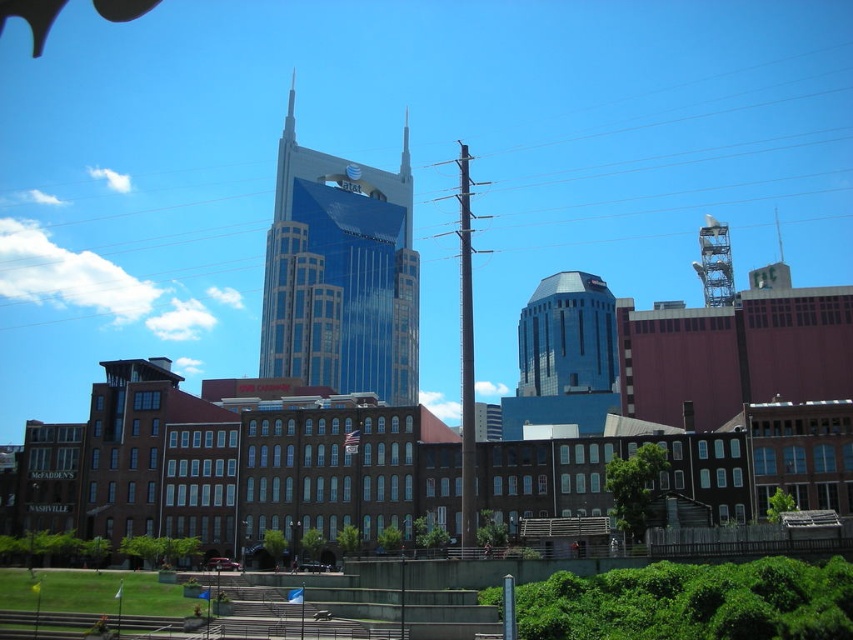
The image size is (853, 640). Describe the element at coordinates (340, 276) in the screenshot. I see `blue glassy skyscraper at center` at that location.

Can you confirm if blue glassy skyscraper at center is wider than shiny silver spire at upper right?

Yes.

Where is `blue glassy skyscraper at center`? blue glassy skyscraper at center is located at coordinates (340, 276).

The width and height of the screenshot is (853, 640). In order to click on blue glassy skyscraper at center in this screenshot , I will do `click(340, 276)`.

Who is positioned more to the right, blue glassy skyscraper at center or metallic lattice tower at upper right?

Positioned to the right is metallic lattice tower at upper right.

Is blue glassy skyscraper at center thinner than metallic lattice tower at upper right?

Correct, blue glassy skyscraper at center's width is less than metallic lattice tower at upper right's.

Does point (390, 328) come in front of point (704, 253)?

No, (390, 328) is further to viewer.

Where is `blue glassy skyscraper at center`? blue glassy skyscraper at center is located at coordinates (340, 276).

Is point (403, 141) positioned behind point (780, 252)?

No, (403, 141) is closer to viewer.

This screenshot has width=853, height=640. Describe the element at coordinates (405, 150) in the screenshot. I see `shiny glass spire at center` at that location.

In order to click on shiny glass spire at center in this screenshot , I will do `click(405, 150)`.

Where is `shiny glass spire at center`? shiny glass spire at center is located at coordinates (405, 150).